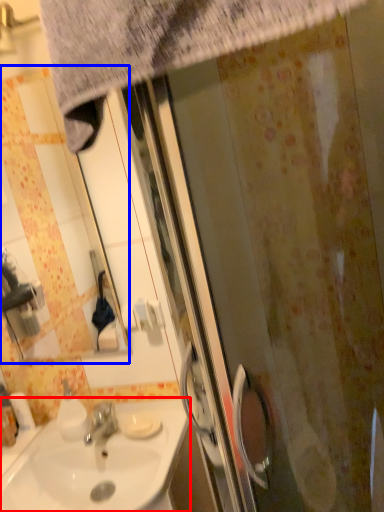
Question: Among these objects, which one is nearest to the camera, sink (highlighted by a red box) or mirror (highlighted by a blue box)?

Choices:
 (A) sink
 (B) mirror

Answer: (A)